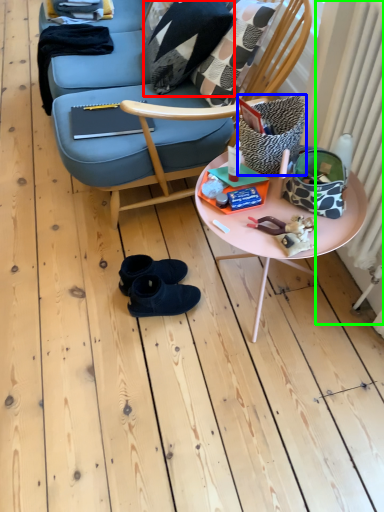
Question: Estimate the real-world distances between objects in this image. Which object is closer to pillow (highlighted by a red box), pillow (highlighted by a blue box) or radiator (highlighted by a green box)?

Choices:
 (A) pillow
 (B) radiator

Answer: (B)